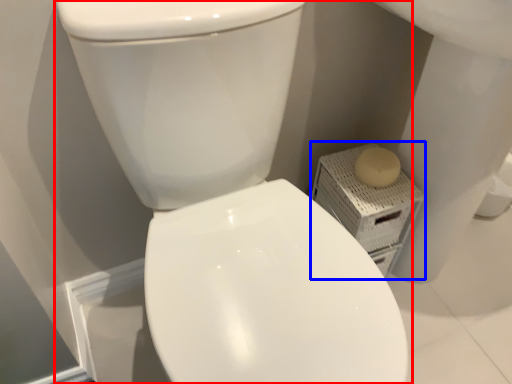
Question: Which object appears closest to the camera in this image, toilet (highlighted by a red box) or porcelain (highlighted by a blue box)?

Choices:
 (A) toilet
 (B) porcelain

Answer: (A)